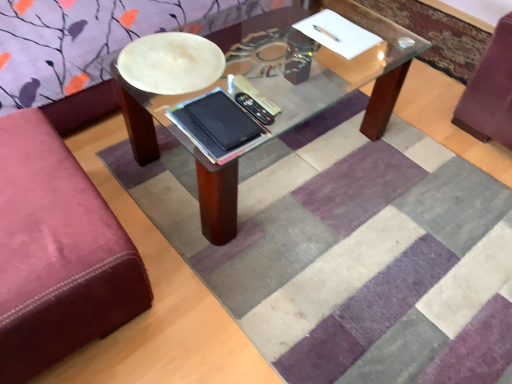
Locate an element on the screen. The image size is (512, 384). vacant region above black matte tablet at center (from a real-world perspective) is located at coordinates (224, 121).